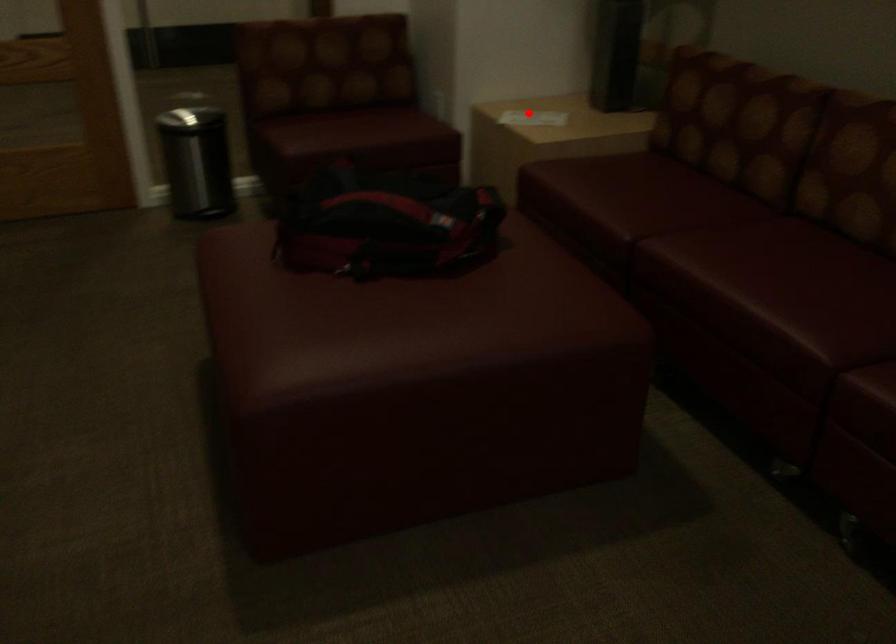
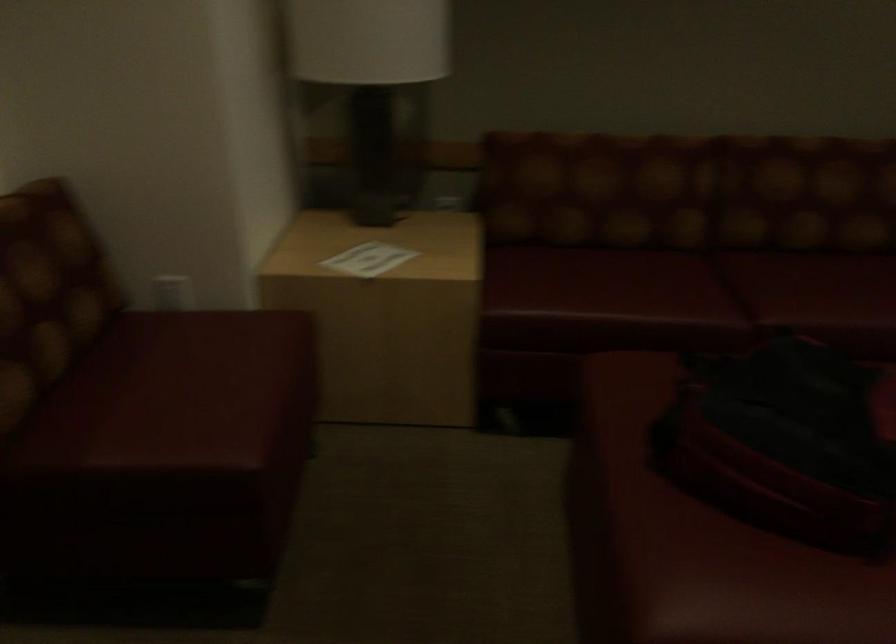
The point at the highlighted location is marked in the first image. Where is the corresponding point in the second image?

(367, 259)